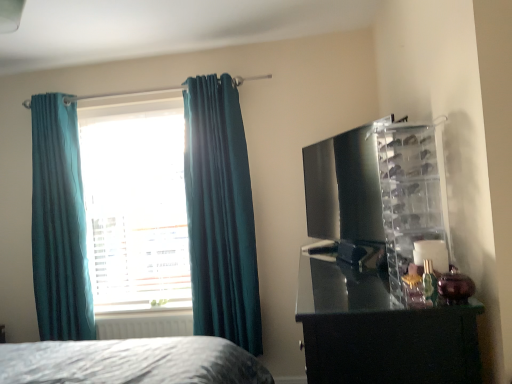
Question: Is glossy black dresser at right at the left side of teal fabric curtain at left, positioned as the 2th curtain in right-to-left order?

Choices:
 (A) no
 (B) yes

Answer: (A)

Question: From the image's perspective, is glossy black dresser at right located beneath teal fabric curtain at left, positioned as the 2th curtain in right-to-left order?

Choices:
 (A) no
 (B) yes

Answer: (B)

Question: From a real-world perspective, is glossy black dresser at right positioned over teal fabric curtain at left, positioned as the 2th curtain in right-to-left order, based on gravity?

Choices:
 (A) no
 (B) yes

Answer: (A)

Question: Is the position of glossy black dresser at right less distant than that of teal fabric curtain at left, positioned as the 2th curtain in right-to-left order?

Choices:
 (A) yes
 (B) no

Answer: (A)

Question: From the image's perspective, is glossy black dresser at right on teal fabric curtain at left, the first curtain from the left?

Choices:
 (A) yes
 (B) no

Answer: (B)

Question: From the image's perspective, relative to white matte radiator at lower left, is teal velvet curtains at left, which is the 1th curtain from right to left, above or below?

Choices:
 (A) below
 (B) above

Answer: (B)

Question: Does point (214, 264) appear closer or farther from the camera than point (141, 327)?

Choices:
 (A) closer
 (B) farther

Answer: (A)

Question: Is teal velvet curtains at left, the 2th curtain from the left, taller or shorter than white matte radiator at lower left?

Choices:
 (A) short
 (B) tall

Answer: (B)

Question: From a real-world perspective, is teal velvet curtains at left, the 2th curtain from the left, above or below white matte radiator at lower left?

Choices:
 (A) below
 (B) above

Answer: (B)

Question: From the image's perspective, is teal fabric window at center positioned above or below white matte radiator at lower left?

Choices:
 (A) below
 (B) above

Answer: (B)

Question: From a real-world perspective, is teal fabric window at center above or below white matte radiator at lower left?

Choices:
 (A) below
 (B) above

Answer: (B)

Question: From their relative heights in the image, would you say teal fabric window at center is taller or shorter than white matte radiator at lower left?

Choices:
 (A) tall
 (B) short

Answer: (A)

Question: Is point (143, 198) closer or farther from the camera than point (164, 314)?

Choices:
 (A) closer
 (B) farther

Answer: (B)

Question: Is point (182, 321) positioned closer to the camera than point (374, 175)?

Choices:
 (A) farther
 (B) closer

Answer: (A)

Question: From a real-world perspective, relative to glossy black dresser at right, is white matte radiator at lower left vertically above or below?

Choices:
 (A) above
 (B) below

Answer: (B)